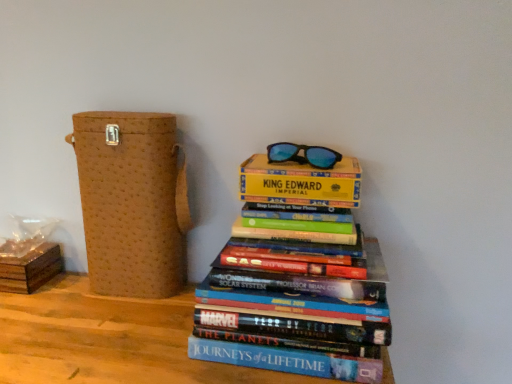
Question: Is brown textured box at left, the second cardboard box in the left-to-right sequence, turned away from hardcover books at center?

Choices:
 (A) yes
 (B) no

Answer: (B)

Question: Is brown textured box at left, the second cardboard box in the left-to-right sequence, aimed at hardcover books at center?

Choices:
 (A) yes
 (B) no

Answer: (B)

Question: From the image's perspective, would you say brown textured box at left, the second cardboard box in the left-to-right sequence, is positioned over hardcover books at center?

Choices:
 (A) no
 (B) yes

Answer: (B)

Question: Could hardcover books at center be considered to be inside brown textured box at left, the first cardboard box from the right?

Choices:
 (A) yes
 (B) no

Answer: (B)

Question: From a real-world perspective, is brown textured box at left, the second cardboard box in the left-to-right sequence, below hardcover books at center?

Choices:
 (A) no
 (B) yes

Answer: (A)

Question: Is brown cardboard box at lower left, which is counted as the 1th cardboard box, starting from the left, spatially inside brown textured box at left, the first cardboard box from the right, or outside of it?

Choices:
 (A) outside
 (B) inside

Answer: (A)

Question: Looking at the image, does brown cardboard box at lower left, the 2th cardboard box from the right, seem bigger or smaller compared to brown textured box at left, the first cardboard box from the right?

Choices:
 (A) big
 (B) small

Answer: (B)

Question: Does point (47, 244) appear closer or farther from the camera than point (182, 216)?

Choices:
 (A) farther
 (B) closer

Answer: (A)

Question: In terms of width, does brown cardboard box at lower left, which is counted as the 1th cardboard box, starting from the left, look wider or thinner when compared to brown textured box at left, the first cardboard box from the right?

Choices:
 (A) wide
 (B) thin

Answer: (A)

Question: Relative to hardcover books at center, is blue reflective lenses at upper center in front or behind?

Choices:
 (A) behind
 (B) front

Answer: (A)

Question: Do you think blue reflective lenses at upper center is within hardcover books at center, or outside of it?

Choices:
 (A) outside
 (B) inside

Answer: (A)

Question: From their relative heights in the image, would you say blue reflective lenses at upper center is taller or shorter than hardcover books at center?

Choices:
 (A) tall
 (B) short

Answer: (B)

Question: In the image, is blue reflective lenses at upper center on the left side or the right side of hardcover books at center?

Choices:
 (A) left
 (B) right

Answer: (B)

Question: Based on their sizes in the image, would you say hardcover books at center is bigger or smaller than brown textured box at left, the first cardboard box from the right?

Choices:
 (A) big
 (B) small

Answer: (A)

Question: From a real-world perspective, is hardcover books at center positioned above or below brown textured box at left, the second cardboard box in the left-to-right sequence?

Choices:
 (A) below
 (B) above

Answer: (A)